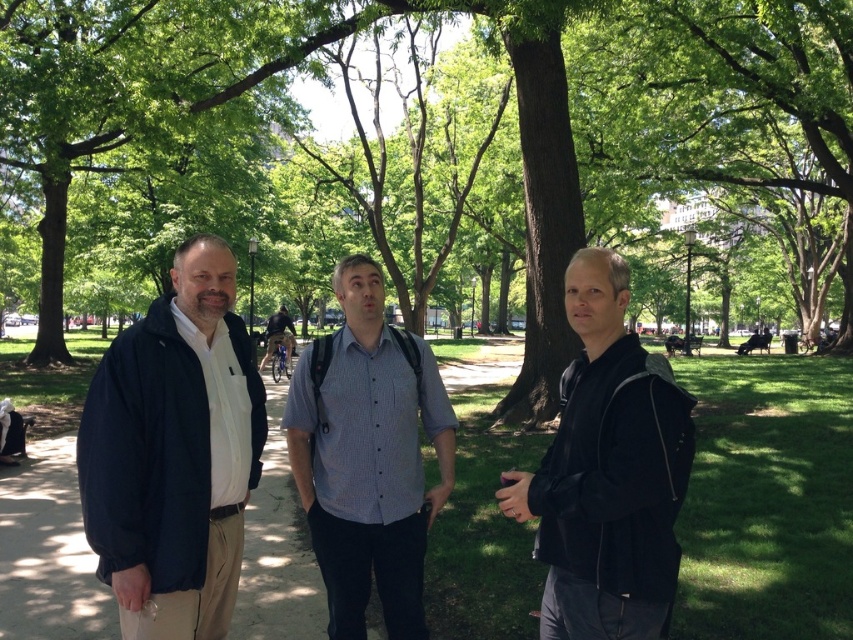
Question: Which object appears farthest from the camera in this image?

Choices:
 (A) matte black jacket at left
 (B) blue striped shirt at center

Answer: (B)

Question: Which point is closer to the camera?

Choices:
 (A) green leafy tree at center
 (B) matte black jacket at left
 (C) blue striped shirt at center

Answer: (B)

Question: Does green leafy tree at center appear on the left side of dark blue jacket at center?

Choices:
 (A) yes
 (B) no

Answer: (A)

Question: Considering the relative positions of matte black jacket at left and blue striped shirt at center in the image provided, where is matte black jacket at left located with respect to blue striped shirt at center?

Choices:
 (A) left
 (B) right

Answer: (A)

Question: Which point is farther to the camera?

Choices:
 (A) (689, 454)
 (B) (666, 401)
 (C) (169, 576)
 (D) (408, 472)

Answer: (D)

Question: From the image, what is the correct spatial relationship of matte black jacket at left in relation to black matte jacket at center?

Choices:
 (A) below
 (B) above

Answer: (B)